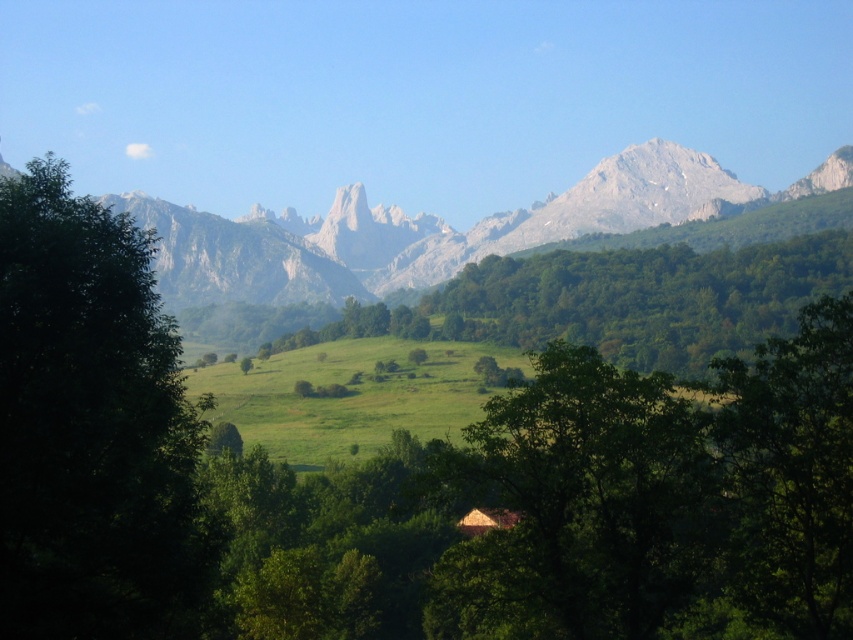
Question: Does green leafy tree at left appear under rocky gray mountain range at center?

Choices:
 (A) yes
 (B) no

Answer: (A)

Question: Which object appears closest to the camera in this image?

Choices:
 (A) green leafy tree at left
 (B) rocky gray mountain range at center

Answer: (A)

Question: Is green leafy tree at left wider than rocky gray mountain range at center?

Choices:
 (A) no
 (B) yes

Answer: (A)

Question: Can you confirm if green leafy tree at left is positioned to the right of rocky gray mountain range at center?

Choices:
 (A) no
 (B) yes

Answer: (A)